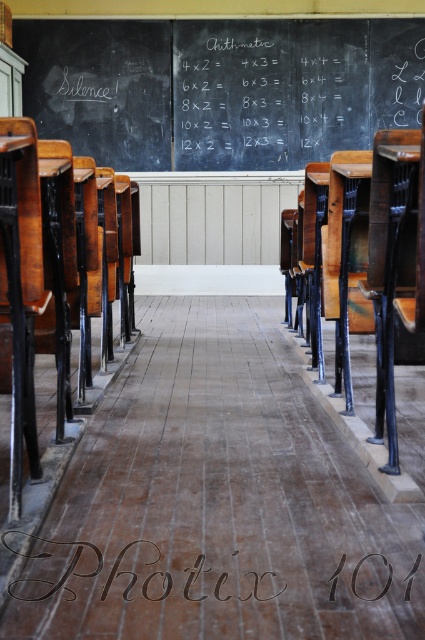
Question: Which point is farther to the camera?

Choices:
 (A) (82, 560)
 (B) (232, 77)

Answer: (B)

Question: Is black chalkboard at upper center positioned before black textured wood at center?

Choices:
 (A) yes
 (B) no

Answer: (B)

Question: Is black chalkboard at upper center positioned before black textured wood at center?

Choices:
 (A) yes
 (B) no

Answer: (B)

Question: Considering the relative positions of black chalkboard at upper center and black textured wood at center in the image provided, where is black chalkboard at upper center located with respect to black textured wood at center?

Choices:
 (A) left
 (B) right

Answer: (B)